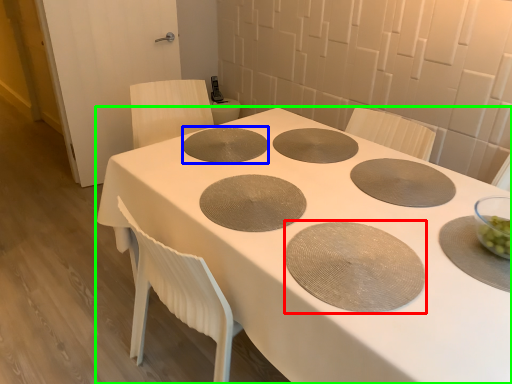
Question: Which object is positioned farthest from oval (highlighted by a red box)? Select from oval (highlighted by a blue box) and table (highlighted by a green box).

Choices:
 (A) oval
 (B) table

Answer: (A)